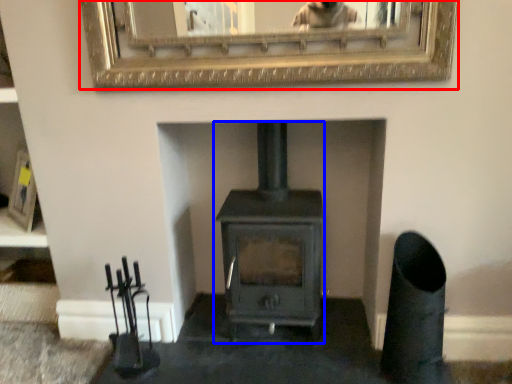
Question: Which point is further to the camera, picture frame (highlighted by a red box) or wood burning stove (highlighted by a blue box)?

Choices:
 (A) picture frame
 (B) wood burning stove

Answer: (B)